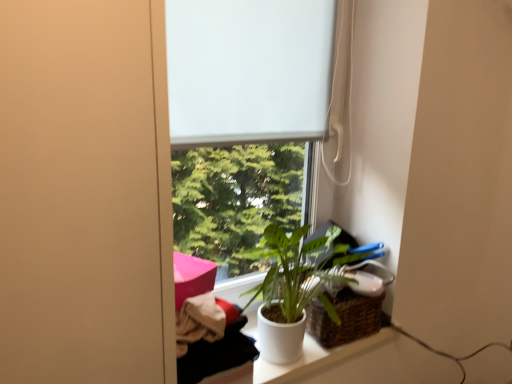
Identify the location of woven brown basket at lower right. The image size is (512, 384). (349, 311).

Where is `woven brown basket at lower right`? The width and height of the screenshot is (512, 384). woven brown basket at lower right is located at coordinates (349, 311).

Is white matte window screen at center in contact with white matte window at center?

Yes, white matte window screen at center is right next to white matte window at center and making contact.

Does white matte window screen at center have a smaller size compared to white matte window at center?

Correct, white matte window screen at center occupies less space than white matte window at center.

From the picture: Considering the sizes of objects white matte window screen at center and white matte window at center in the image provided, who is wider, white matte window screen at center or white matte window at center?

white matte window at center.

Consider the image. From a real-world perspective, which object stands above the other?

white matte window screen at center is physically above.

Consider the image. Which of these two, woven brown basket at lower right or white matte window at center, stands shorter?

woven brown basket at lower right is shorter.

Does point (378, 274) appear closer or farther from the camera than point (293, 50)?

Point (378, 274) is farther from the camera than point (293, 50).

Can you tell me how much woven brown basket at lower right and white matte window at center differ in facing direction?

There is a 0.549-degree angle between the facing directions of woven brown basket at lower right and white matte window at center.

From the image's perspective, does woven brown basket at lower right appear higher than white matte window at center?

No, from the image's perspective, woven brown basket at lower right is not above white matte window at center.

Does woven brown basket at lower right have a lesser height compared to white matte window screen at center?

Yes.

Is woven brown basket at lower right outside of white matte window screen at center?

Indeed, woven brown basket at lower right is completely outside white matte window screen at center.

Locate an element on the screen. window screen on the left of the woven brown basket at lower right is located at coordinates (248, 70).

Is woven brown basket at lower right directly adjacent to white matte window screen at center?

No.

What's the angular difference between white matte window at center and white matte window screen at center's facing directions?

The angular difference between white matte window at center and white matte window screen at center is 0.00844 degrees.

Is white matte window screen at center at the back of white matte window at center?

Yes.

From a real-world perspective, is white matte window at center on top of white matte window screen at center?

No, from a real-world perspective, white matte window at center is not above white matte window screen at center.

Can you confirm if white matte window at center is bigger than white matte window screen at center?

Correct, white matte window at center is larger in size than white matte window screen at center.

Is white matte window at center facing towards woven brown basket at lower right?

No, white matte window at center is not aimed at woven brown basket at lower right.

Where is `window to the left of woven brown basket at lower right`? This screenshot has height=384, width=512. window to the left of woven brown basket at lower right is located at coordinates (248, 71).

Can you confirm if white matte window at center is smaller than woven brown basket at lower right?

Actually, white matte window at center might be larger than woven brown basket at lower right.

Which object is positioned more to the right, white matte window at center or woven brown basket at lower right?

Positioned to the right is woven brown basket at lower right.

Looking at this image, are white matte window screen at center and woven brown basket at lower right far apart?

Actually, white matte window screen at center and woven brown basket at lower right are a little close together.

Does white matte window screen at center have a lesser width compared to woven brown basket at lower right?

Correct, the width of white matte window screen at center is less than that of woven brown basket at lower right.

From the image's perspective, is white matte window screen at center on woven brown basket at lower right?

Yes, from the image's perspective, white matte window screen at center is over woven brown basket at lower right.

Considering the sizes of objects white matte window screen at center and woven brown basket at lower right in the image provided, who is taller, white matte window screen at center or woven brown basket at lower right?

Standing taller between the two is white matte window screen at center.

Image resolution: width=512 pixels, height=384 pixels. In the image, there is a white matte window screen at center. What are the coordinates of `window below it (from a real-world perspective)` in the screenshot? It's located at (248, 71).

Where is `window that is above the woven brown basket at lower right (from a real-world perspective)`? The height and width of the screenshot is (384, 512). window that is above the woven brown basket at lower right (from a real-world perspective) is located at coordinates (248, 71).

When comparing their distances from white matte window at center, does woven brown basket at lower right or white matte window screen at center seem further?

Based on the image, woven brown basket at lower right appears to be further to white matte window at center.

When comparing their distances from white matte window screen at center, does woven brown basket at lower right or white matte window at center seem closer?

white matte window at center lies closer to white matte window screen at center than the other object.

Considering their positions, is white matte window screen at center positioned closer to woven brown basket at lower right than white matte window at center?

Among the two, white matte window at center is located nearer to woven brown basket at lower right.

Consider the image. Which object lies nearer to the anchor point white matte window at center, white matte window screen at center or woven brown basket at lower right?

white matte window screen at center lies closer to white matte window at center than the other object.

Estimate the real-world distances between objects in this image. Which object is closer to white matte window screen at center, white matte window at center or woven brown basket at lower right?

white matte window at center lies closer to white matte window screen at center than the other object.

When comparing their distances from woven brown basket at lower right, does white matte window at center or white matte window screen at center seem further?

Based on the image, white matte window screen at center appears to be further to woven brown basket at lower right.

Identify the location of window between white matte window screen at center and woven brown basket at lower right in the up-down direction. (248, 71).